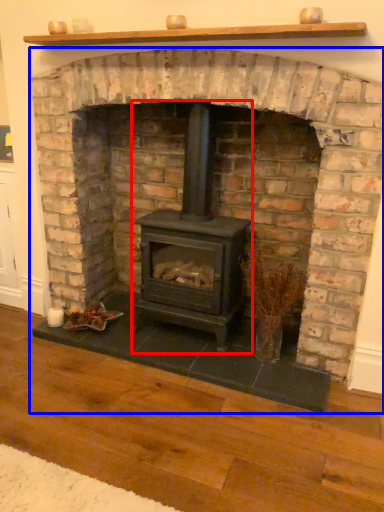
Question: Among these objects, which one is nearest to the camera, wood burning stove (highlighted by a red box) or fireplace (highlighted by a blue box)?

Choices:
 (A) wood burning stove
 (B) fireplace

Answer: (B)